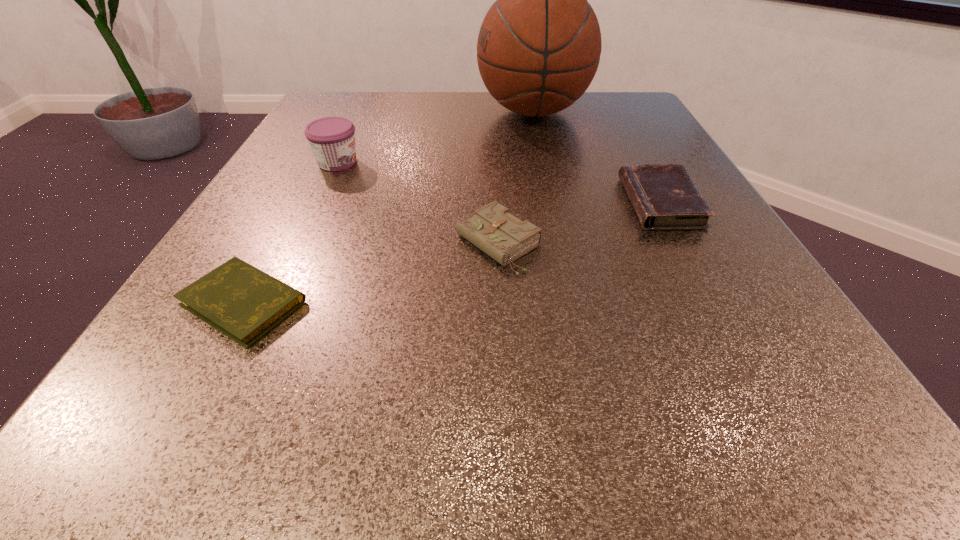
This screenshot has width=960, height=540. Find the location of `diary that is the second nearest to the shortest object`. diary that is the second nearest to the shortest object is located at coordinates (664, 196).

This screenshot has width=960, height=540. What are the coordinates of `blank space that satisfies the following two spatial constraints: 1. on the side with brand label of the farthest object; 2. on the back side of the rightmost diary` in the screenshot? It's located at (553, 203).

Find the location of a particular element. free space that satisfies the following two spatial constraints: 1. on the front label of the rightmost diary; 2. on the right side of the fourth nearest object is located at coordinates (318, 203).

Identify the location of vacant region that satisfies the following two spatial constraints: 1. on the front label of the fourth shortest object; 2. on the right side of the second diary from right to left. The image size is (960, 540). pos(299,244).

Locate an element on the screen. The image size is (960, 540). vacant space that satisfies the following two spatial constraints: 1. on the side with brand label of the basketball; 2. on the front side of the leftmost diary is located at coordinates (574, 303).

Identify the location of vacant space that satisfies the following two spatial constraints: 1. on the front label of the second tallest object; 2. on the right side of the rightmost diary. This screenshot has width=960, height=540. (318, 203).

The image size is (960, 540). I want to click on blank area in the image that satisfies the following two spatial constraints: 1. on the front label of the second tallest object; 2. on the left side of the second diary from left to right, so click(x=299, y=244).

I want to click on free space that satisfies the following two spatial constraints: 1. on the side with brand label of the basketball; 2. on the left side of the rightmost diary, so click(553, 203).

Identify the location of free space that satisfies the following two spatial constraints: 1. on the front label of the second diary from right to left; 2. on the right side of the jam. This screenshot has width=960, height=540. (299, 244).

Find the location of a particular element. free space in the image that satisfies the following two spatial constraints: 1. on the back side of the rightmost diary; 2. on the right side of the leftmost diary is located at coordinates (298, 203).